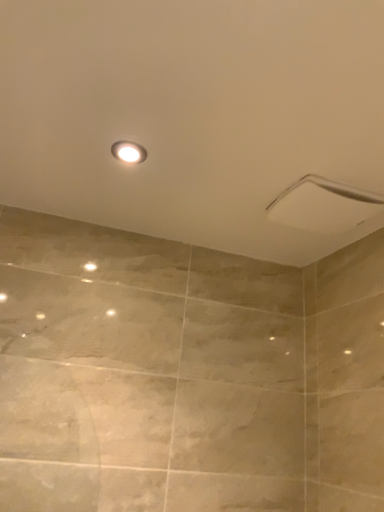
The image size is (384, 512). What do you see at coordinates (129, 152) in the screenshot?
I see `white glossy light fixture at upper center` at bounding box center [129, 152].

What is the approximate height of white glossy light fixture at upper center?

It is 0.60 inches.

Find the location of `white glossy light fixture at upper center`. white glossy light fixture at upper center is located at coordinates (129, 152).

The height and width of the screenshot is (512, 384). What do you see at coordinates (330, 191) in the screenshot?
I see `white glossy shower head at upper right` at bounding box center [330, 191].

What is the approximate height of white glossy shower head at upper right?

The height of white glossy shower head at upper right is 4.16 centimeters.

Measure the distance between point (290,192) and camera.

Point (290,192) is 3.45 feet away from camera.

Identify the location of white glossy shower head at upper right. The image size is (384, 512). (330, 191).

Find the location of a particular element. The height and width of the screenshot is (512, 384). white glossy light fixture at upper center is located at coordinates (129, 152).

Visually, is white glossy light fixture at upper center positioned to the left or to the right of white glossy shower head at upper right?

white glossy light fixture at upper center is to the left of white glossy shower head at upper right.

Is white glossy light fixture at upper center positioned behind white glossy shower head at upper right?

No, the depth of white glossy light fixture at upper center is less than that of white glossy shower head at upper right.

Which is behind, point (124, 144) or point (339, 183)?

Point (339, 183)

From the image's perspective, which one is positioned lower, white glossy light fixture at upper center or white glossy shower head at upper right?

From the image's view, white glossy shower head at upper right is below.

From a real-world perspective, is white glossy light fixture at upper center located higher than white glossy shower head at upper right?

Correct, in the physical world, white glossy light fixture at upper center is higher than white glossy shower head at upper right.

Which of these two, white glossy light fixture at upper center or white glossy shower head at upper right, is thinner?

With smaller width is white glossy light fixture at upper center.

Is white glossy light fixture at upper center shorter than white glossy shower head at upper right?

Yes.

Who is smaller, white glossy light fixture at upper center or white glossy shower head at upper right?

Smaller between the two is white glossy light fixture at upper center.

Is white glossy light fixture at upper center outside of white glossy shower head at upper right?

white glossy light fixture at upper center is positioned outside white glossy shower head at upper right.

Is there a large distance between white glossy light fixture at upper center and white glossy shower head at upper right?

white glossy light fixture at upper center is near white glossy shower head at upper right, not far away.

Could you tell me if white glossy light fixture at upper center is facing white glossy shower head at upper right?

No, white glossy light fixture at upper center is not oriented towards white glossy shower head at upper right.

How many degrees apart are the facing directions of white glossy light fixture at upper center and white glossy shower head at upper right?

The angular difference between white glossy light fixture at upper center and white glossy shower head at upper right is 1.71 degrees.

At what (x,y) coordinates should I click in order to perform the action: click on shower below the white glossy light fixture at upper center (from a real-world perspective). Please return your answer as a coordinate pair (x, y). Looking at the image, I should click on (330, 191).

Does white glossy shower head at upper right appear on the left side of white glossy light fixture at upper center?

Incorrect, white glossy shower head at upper right is not on the left side of white glossy light fixture at upper center.

Is white glossy shower head at upper right in front of or behind white glossy light fixture at upper center in the image?

Visually, white glossy shower head at upper right is located behind white glossy light fixture at upper center.

Based on the photo, which is less distant, [362,192] or [119,154]?

Point [362,192] is farther from the camera than point [119,154].

From the image's perspective, which is below, white glossy shower head at upper right or white glossy light fixture at upper center?

white glossy shower head at upper right is shown below in the image.

From a real-world perspective, is white glossy shower head at upper right located higher than white glossy light fixture at upper center?

No.

Looking at their sizes, would you say white glossy shower head at upper right is wider or thinner than white glossy light fixture at upper center?

white glossy shower head at upper right is wider than white glossy light fixture at upper center.

From their relative heights in the image, would you say white glossy shower head at upper right is taller or shorter than white glossy light fixture at upper center?

Considering their sizes, white glossy shower head at upper right has more height than white glossy light fixture at upper center.

Can you confirm if white glossy shower head at upper right is smaller than white glossy light fixture at upper center?

Actually, white glossy shower head at upper right might be larger than white glossy light fixture at upper center.

Would you say white glossy shower head at upper right contains white glossy light fixture at upper center?

Actually, white glossy light fixture at upper center is outside white glossy shower head at upper right.

Is white glossy shower head at upper right with white glossy light fixture at upper center?

No, white glossy shower head at upper right is not in contact with white glossy light fixture at upper center.

Does white glossy shower head at upper right turn towards white glossy light fixture at upper center?

No, white glossy shower head at upper right is not turned towards white glossy light fixture at upper center.

What's the angular difference between white glossy shower head at upper right and white glossy light fixture at upper center's facing directions?

The facing directions of white glossy shower head at upper right and white glossy light fixture at upper center are 1.71 degrees apart.

How much distance is there between white glossy shower head at upper right and white glossy light fixture at upper center?

white glossy shower head at upper right and white glossy light fixture at upper center are 44.33 centimeters apart from each other.

Image resolution: width=384 pixels, height=512 pixels. Identify the location of light fixture in front of the white glossy shower head at upper right. (129, 152).

Image resolution: width=384 pixels, height=512 pixels. What are the coordinates of `shower on the right of the white glossy light fixture at upper center` in the screenshot? It's located at (330, 191).

Where is `light fixture lying on the left of white glossy shower head at upper right`? The image size is (384, 512). light fixture lying on the left of white glossy shower head at upper right is located at coordinates (129, 152).